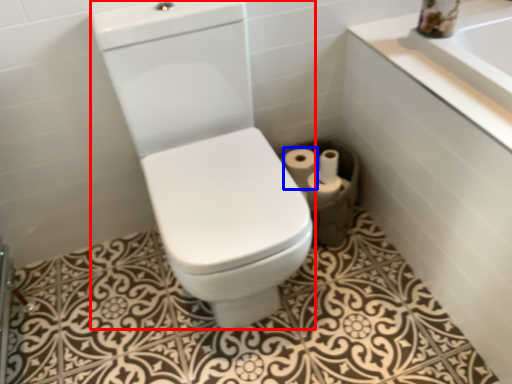
Question: Which of the following is the farthest to the observer, sit (highlighted by a red box) or toilet paper (highlighted by a blue box)?

Choices:
 (A) sit
 (B) toilet paper

Answer: (B)